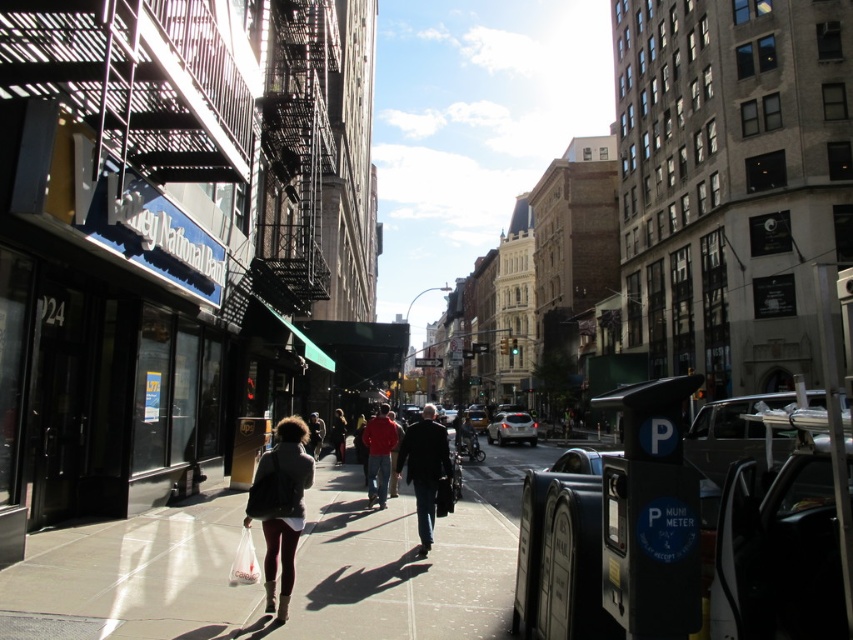
You are a delivery person who needs to pick up an item from the white plastic bag at lower center and the dark brown leather jacket at center. Which item is easier to reach without bending down?

The white plastic bag at lower center is located above the dark brown leather jacket at center, so it is easier to reach without bending down.

You are a street vendor standing on the sidewalk and want to place a 1.2 meter tall stand between the dark gray jacket at center and the dark brown leather jacket at center. Can the stand fit between them?

The dark gray jacket at center is taller than the dark brown leather jacket at center, but the height difference does not affect the horizontal space between them. Since the question is about fitting a vertical stand, the height of the jackets is irrelevant. The stand can be placed between them as long as there is enough horizontal space, which isn not specified here.